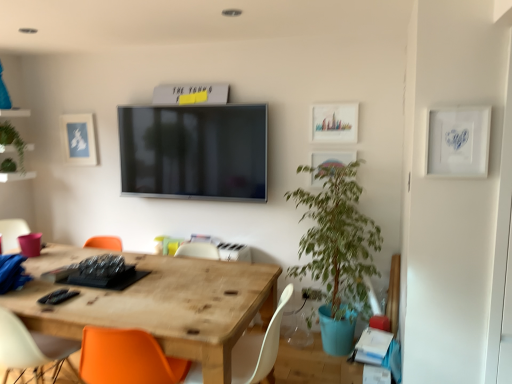
The image size is (512, 384). Identify the location of wooden table at center. (167, 307).

Describe the element at coordinates (167, 307) in the screenshot. The image size is (512, 384). I see `wooden table at center` at that location.

Measure the distance between point (241, 337) and camera.

Point (241, 337) is 2.58 meters away from camera.

Identify the location of green leafy plant in blue pot at right. (337, 250).

Find the location of a particular element. wooden table at center is located at coordinates (167, 307).

Between green leafy plant at left and wooden table at center, which one has less height?

With less height is green leafy plant at left.

Does green leafy plant at left have a lesser width compared to wooden table at center?

Yes, green leafy plant at left is thinner than wooden table at center.

Looking at this image, which is behind, green leafy plant at left or wooden table at center?

Positioned behind is green leafy plant at left.

From the picture: Is green leafy plant at left at the left side of wooden table at center?

Yes.

Between matte blue paper at upper left and green leafy plant at left, which one has more height?

matte blue paper at upper left.

Would you say green leafy plant at left is part of matte blue paper at upper left's contents?

No, green leafy plant at left is located outside of matte blue paper at upper left.

Who is bigger, matte blue paper at upper left or green leafy plant at left?

With larger size is green leafy plant at left.

From a real-world perspective, between matte blue paper at upper left and green leafy plant at left, who is vertically higher?

From a 3D spatial view, green leafy plant at left is above.

Based on the photo, does green leafy plant at left turn towards matte blue paper at upper left?

No, green leafy plant at left is not facing towards matte blue paper at upper left.

Is the depth of green leafy plant at left greater than that of matte blue paper at upper left?

No, green leafy plant at left is in front of matte blue paper at upper left.

Is green leafy plant at left at the left side of matte blue paper at upper left?

Correct, you'll find green leafy plant at left to the left of matte blue paper at upper left.

Who is taller, green leafy plant at left or matte blue paper at upper left?

With more height is matte blue paper at upper left.

Can you confirm if wooden table at center is shorter than green leafy plant at left?

In fact, wooden table at center may be taller than green leafy plant at left.

Which of these two, wooden table at center or green leafy plant at left, is smaller?

Smaller between the two is green leafy plant at left.

From the image's perspective, who appears lower, wooden table at center or green leafy plant at left?

From the image's view, wooden table at center is below.

Which object is more forward, wooden table at center or green leafy plant at left?

wooden table at center.

How many degrees apart are the facing directions of white matte chair at lower center and green leafy plant in blue pot at right?

The facing directions of white matte chair at lower center and green leafy plant in blue pot at right are 90.1 degrees apart.

Choose the correct answer: Is white matte chair at lower center inside green leafy plant in blue pot at right or outside it?

white matte chair at lower center exists outside the volume of green leafy plant in blue pot at right.

Considering the positions of objects white matte chair at lower center and green leafy plant in blue pot at right in the image provided, who is more to the left, white matte chair at lower center or green leafy plant in blue pot at right?

white matte chair at lower center.

From the image's perspective, is white matte chair at lower center over green leafy plant in blue pot at right?

No, from the image's perspective, white matte chair at lower center is not over green leafy plant in blue pot at right.

Is green leafy plant at left at the right side of white matte chair at lower center?

No.

Is green leafy plant at left wider than white matte chair at lower center?

No.

Is point (3, 123) farther from viewer compared to point (250, 362)?

That is True.

From the image's perspective, relative to white matte chair at lower center, is green leafy plant at left above or below?

From the image's perspective, green leafy plant at left appears above white matte chair at lower center.

Between wooden table at center and green leafy plant in blue pot at right, which one has smaller size?

green leafy plant in blue pot at right is smaller.

Is wooden table at center closer to the viewer compared to green leafy plant in blue pot at right?

That is True.

Is wooden table at center wider or thinner than green leafy plant in blue pot at right?

Considering their sizes, wooden table at center looks broader than green leafy plant in blue pot at right.

How distant is wooden table at center from green leafy plant in blue pot at right?

34.71 inches.

Find the location of `desk in front of the green leafy plant at left`. desk in front of the green leafy plant at left is located at coordinates (167, 307).

At what (x,y) coordinates should I click in order to perform the action: click on picture frame on the right of green leafy plant at left. Please return your answer as a coordinate pair (x, y). Looking at the image, I should click on (78, 139).

From the image, which object appears to be farther from wooden table at center, white matte chair at lower center or green leafy plant in blue pot at right?

green leafy plant in blue pot at right.

Estimate the real-world distances between objects in this image. Which object is closer to green leafy plant in blue pot at right, matte blue paper at upper left or wooden table at center?

wooden table at center lies closer to green leafy plant in blue pot at right than the other object.

Looking at this image, which object lies nearer to the anchor point green leafy plant at left, white matte chair at lower center or matte blue paper at upper left?

matte blue paper at upper left lies closer to green leafy plant at left than the other object.

Looking at the image, which one is located further to white matte chair at lower center, wooden table at center or green leafy plant at left?

green leafy plant at left is positioned further to the anchor white matte chair at lower center.

Based on their spatial positions, is green leafy plant in blue pot at right or wooden table at center further from white matte chair at lower center?

green leafy plant in blue pot at right is further to white matte chair at lower center.

Considering their positions, is matte blue paper at upper left positioned further to wooden table at center than green leafy plant at left?

green leafy plant at left.

Estimate the real-world distances between objects in this image. Which object is further from white matte chair at lower center, green leafy plant in blue pot at right or green leafy plant at left?

The object further to white matte chair at lower center is green leafy plant at left.

From the image, which object appears to be farther from white matte chair at lower center, green leafy plant at left or wooden table at center?

Based on the image, green leafy plant at left appears to be further to white matte chair at lower center.

Where is `desk situated between matte blue paper at upper left and green leafy plant in blue pot at right from left to right`? The image size is (512, 384). desk situated between matte blue paper at upper left and green leafy plant in blue pot at right from left to right is located at coordinates (167, 307).

Identify the location of desk between green leafy plant at left and green leafy plant in blue pot at right. (167, 307).

You are a GUI agent. You are given a task and a screenshot of the screen. Output one action in this format:
    pyautogui.click(x=<x>, y=<y>)
    Task: Click on the chair between green leafy plant at left and green leafy plant in blue pot at right from left to right
    This screenshot has width=512, height=384.
    Given the screenshot: What is the action you would take?
    pyautogui.click(x=259, y=348)

The image size is (512, 384). I want to click on picture frame between green leafy plant at left and green leafy plant in blue pot at right from left to right, so click(78, 139).